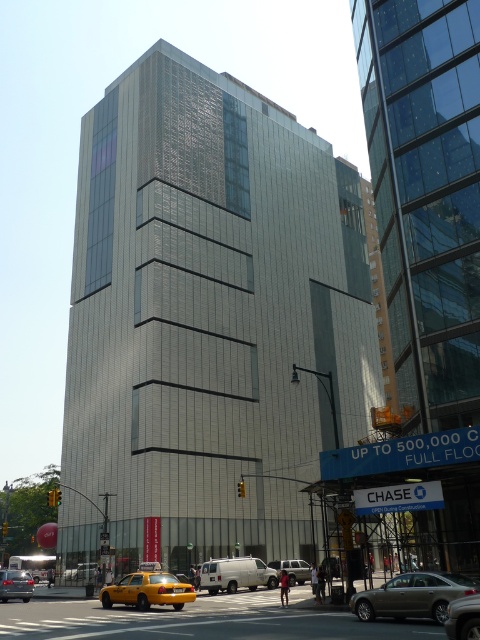
Can you confirm if yellow matte taxi at lower left is smaller than metallic silver car at lower left?

Actually, yellow matte taxi at lower left might be larger than metallic silver car at lower left.

Which is in front, point (99, 596) or point (2, 595)?

Point (99, 596) is more forward.

The width and height of the screenshot is (480, 640). I want to click on yellow matte taxi at lower left, so click(147, 589).

Who is shorter, white matte van at center or metallic silver car at lower left?

metallic silver car at lower left is shorter.

Looking at this image, does white matte van at center appear over metallic silver car at lower left?

Incorrect, white matte van at center is not positioned above metallic silver car at lower left.

This screenshot has width=480, height=640. Identify the location of white matte van at center. (236, 573).

You are a GUI agent. You are given a task and a screenshot of the screen. Output one action in this format:
    pyautogui.click(x=<x>, y=<y>)
    Task: Click on the white matte van at center
    
    Given the screenshot: What is the action you would take?
    pyautogui.click(x=236, y=573)

Is gold metallic sedan at lower right smaller than metallic silver sedan at lower right?

Yes, gold metallic sedan at lower right is smaller than metallic silver sedan at lower right.

Is gold metallic sedan at lower right positioned at the back of metallic silver sedan at lower right?

Yes, gold metallic sedan at lower right is behind metallic silver sedan at lower right.

What are the coordinates of `gold metallic sedan at lower right` in the screenshot? It's located at (412, 595).